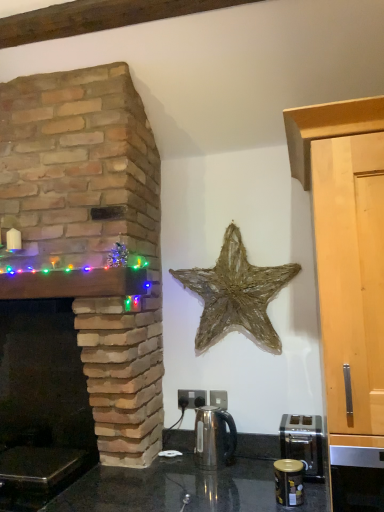
Question: From a real-world perspective, relative to light wood cabinet at right, is satin silver kettle at center vertically above or below?

Choices:
 (A) above
 (B) below

Answer: (B)

Question: In terms of size, does satin silver kettle at center appear bigger or smaller than light wood cabinet at right?

Choices:
 (A) small
 (B) big

Answer: (A)

Question: Estimate the real-world distances between objects in this image. Which object is closer to the light wood cabinet at right?

Choices:
 (A) woven straw star at center
 (B) natural stone fireplace at left
 (C) satin silver toaster at lower right, the 2th appliance in the front-to-back sequence
 (D) black granite countertop at lower center
 (E) metallic gold canister at lower right, the second appliance from the back

Answer: (C)

Question: Considering the real-world distances, which object is closest to the black granite countertop at lower center?

Choices:
 (A) satin silver kettle at center
 (B) light wood cabinet at right
 (C) satin silver toaster at lower right, the 2th appliance in the front-to-back sequence
 (D) woven straw star at center
 (E) natural stone fireplace at left

Answer: (A)